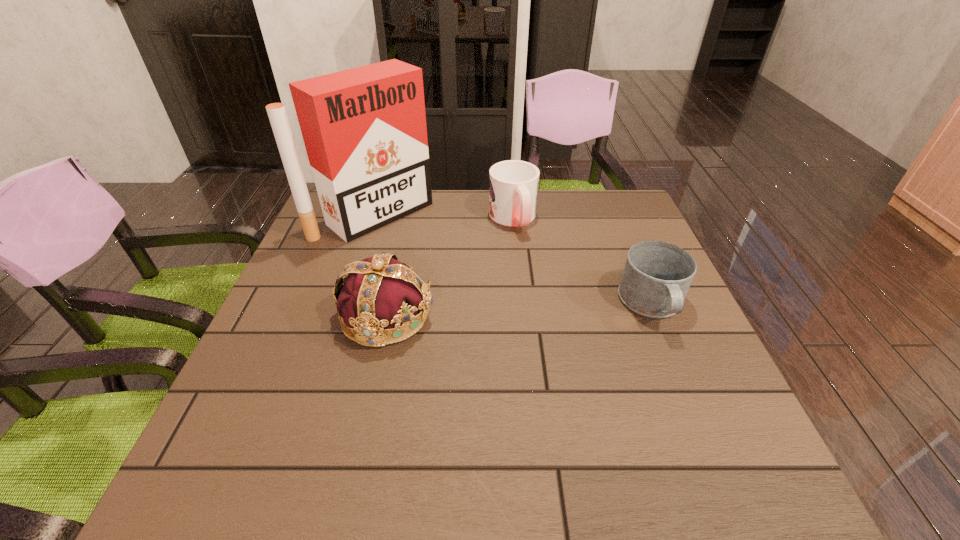
The width and height of the screenshot is (960, 540). What are the coordinates of `vacant region between the left mug and the crown` in the screenshot? It's located at (449, 267).

The height and width of the screenshot is (540, 960). Find the location of `vacant area between the taller mug and the shortest object`. vacant area between the taller mug and the shortest object is located at coordinates (583, 262).

Where is `vacant space that is in between the second tallest object and the farther mug`? vacant space that is in between the second tallest object and the farther mug is located at coordinates (449, 267).

Identify which object is the third closest to the third object from left to right. Please provide its 2D coordinates. Your answer should be formatted as a tuple, i.e. [(x, y)], where the tuple contains the x and y coordinates of a point satisfying the conditions above.

[(657, 275)]

Find the location of a particular element. This screenshot has height=540, width=960. object that is the closest to the second object from right to left is located at coordinates (364, 129).

At what (x,y) coordinates should I click in order to perform the action: click on free space that satisfies the following two spatial constraints: 1. on the front side of the cigarette case; 2. on the right side of the crown. Please return your answer as a coordinate pair (x, y). Looking at the image, I should click on (x=341, y=316).

Identify the location of vacant space that satisfies the following two spatial constraints: 1. on the front side of the second object from right to left; 2. on the left side of the cigarette case. (373, 219).